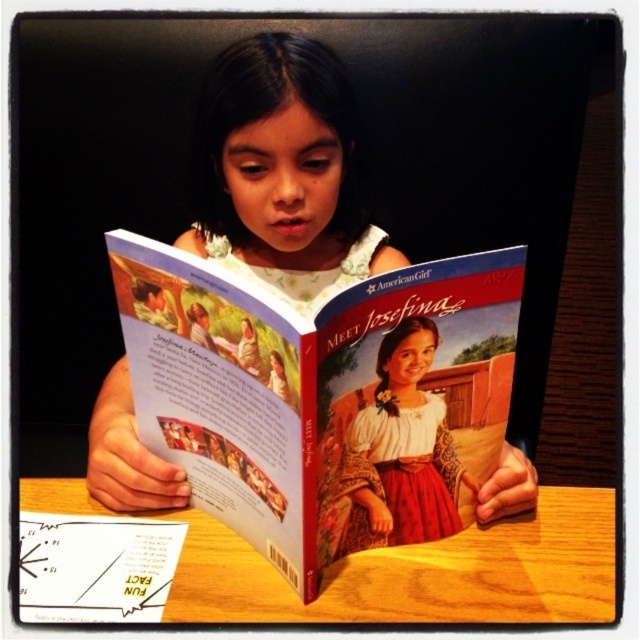
In the scene shown: Does matte paper book at center have a lesser height compared to white floral dress at center?

Correct, matte paper book at center is not as tall as white floral dress at center.

Consider the image. Between matte paper book at center and white floral dress at center, which one has less height?

matte paper book at center is shorter.

Which is in front, point (445, 486) or point (220, 186)?

Point (445, 486)

Identify the location of matte paper book at center. (321, 397).

Does matte paper book at center have a larger size compared to wooden table at center?

Indeed, matte paper book at center has a larger size compared to wooden table at center.

Between point (467, 435) and point (358, 564), which one is positioned in front?

Point (467, 435) is more forward.

Where is `matte paper book at center`? The image size is (640, 640). matte paper book at center is located at coordinates (321, 397).

Which is in front, point (280, 145) or point (522, 588)?

Point (522, 588)

Does white floral dress at center have a larger size compared to wooden table at center?

Correct, white floral dress at center is larger in size than wooden table at center.

Does point (336, 248) come behind point (602, 563)?

Yes.

Where is `white floral dress at center`? The height and width of the screenshot is (640, 640). white floral dress at center is located at coordinates (282, 170).